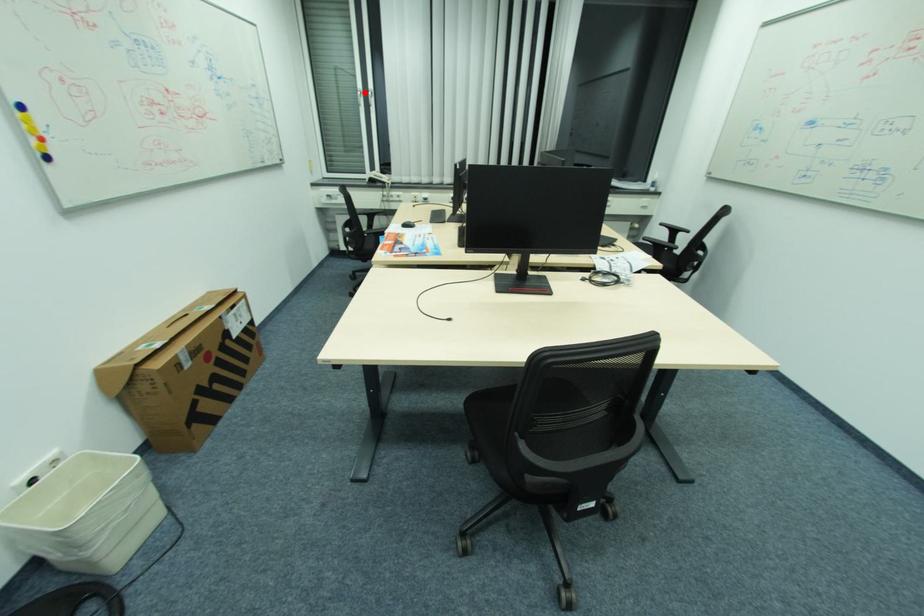
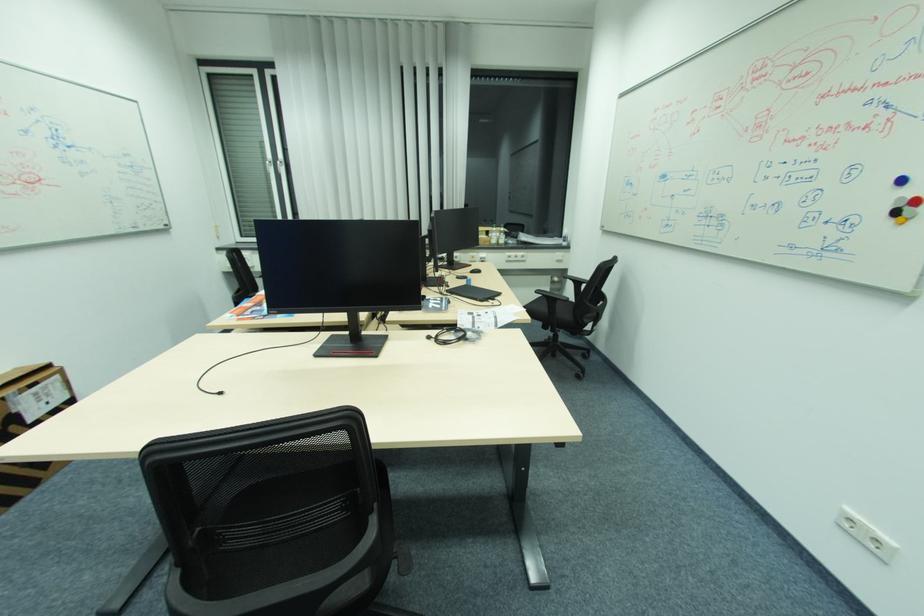
Question: I am providing you with two images of the same scene from different viewpoints. Image1 has a red point marked. In image2, the corresponding 3D location appears at what relative position? Reply with the corresponding letter.

Choices:
 (A) Closer
 (B) Farther

Answer: (B)